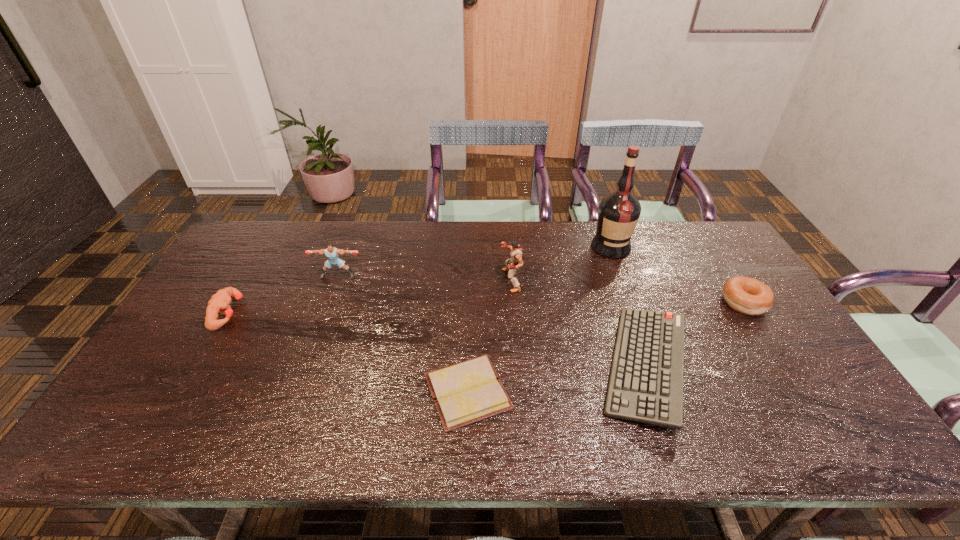
I want to click on the tallest object, so click(x=618, y=213).

This screenshot has width=960, height=540. What are the coordinates of `liquor` in the screenshot? It's located at [x=618, y=213].

Find the location of a particular element. This screenshot has height=540, width=960. the tallest puncher is located at coordinates pyautogui.click(x=515, y=262).

Where is `the sixth shortest object`? the sixth shortest object is located at coordinates (515, 262).

You are a GUI agent. You are given a task and a screenshot of the screen. Output one action in this format:
    pyautogui.click(x=<x>, y=<y>)
    Task: Click on the second shortest puncher
    The width and height of the screenshot is (960, 540).
    Given the screenshot: What is the action you would take?
    pyautogui.click(x=332, y=253)

What are the coordinates of `the second puncher from left to right` in the screenshot? It's located at (332, 253).

The width and height of the screenshot is (960, 540). Identify the location of the shortest puncher. (219, 303).

Find the location of a particular element. the nearest puncher is located at coordinates (219, 303).

This screenshot has height=540, width=960. Identify the location of bagel. (749, 296).

Where is `computer keyboard`? computer keyboard is located at coordinates (646, 381).